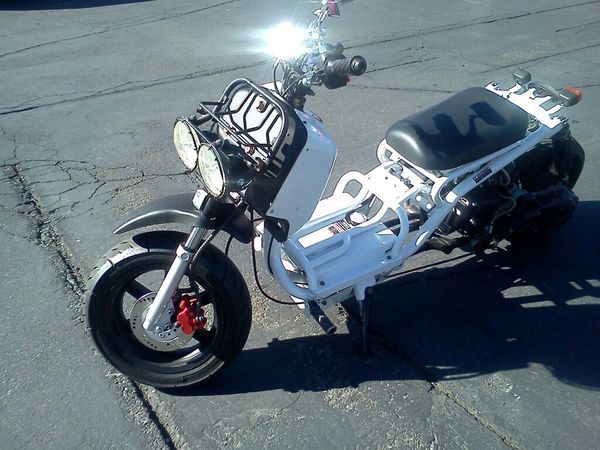
Identify the location of black cushioned seat. (461, 119).